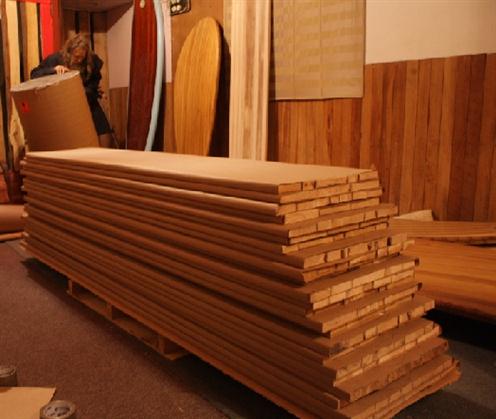
This screenshot has height=419, width=496. What are the coordinates of `wall` in the screenshot? It's located at (410, 31).